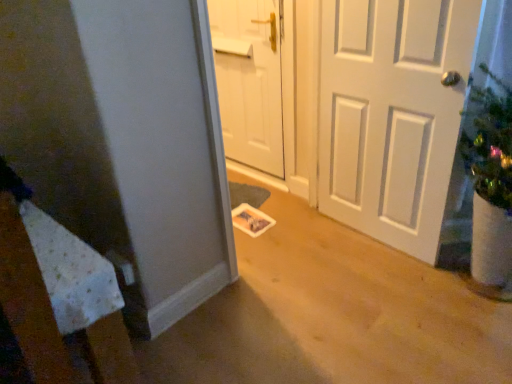
This screenshot has width=512, height=384. Find the location of `free space in front of white matte door at right, the 2th door from the left`. free space in front of white matte door at right, the 2th door from the left is located at coordinates (384, 290).